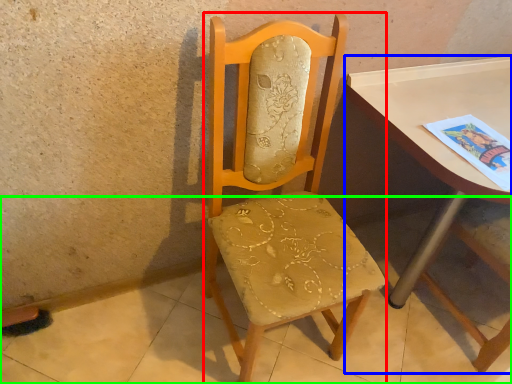
Question: Considering the real-world distances, which object is closest to chair (highlighted by a red box)? table (highlighted by a blue box) or concrete (highlighted by a green box).

Choices:
 (A) table
 (B) concrete

Answer: (A)